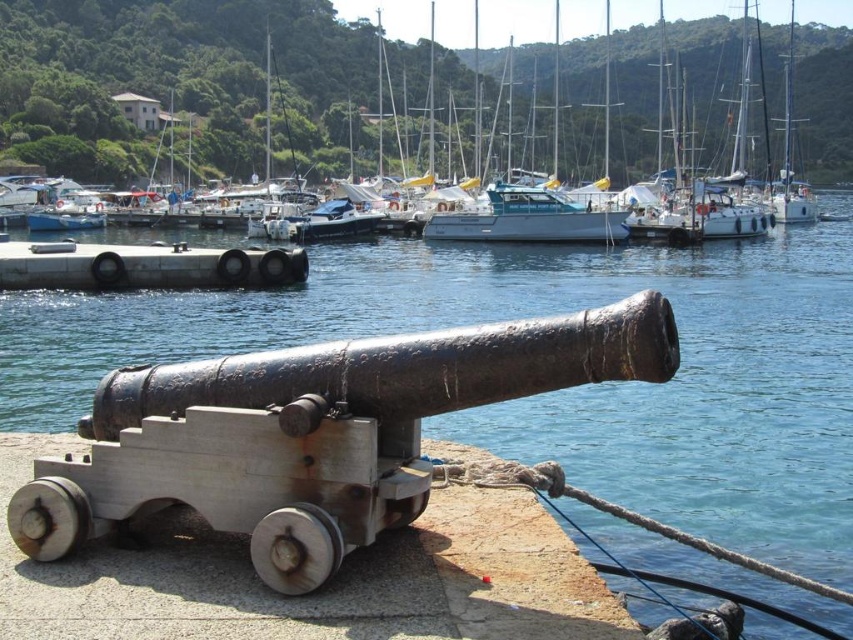
Question: Which object is farther from the camera taking this photo?

Choices:
 (A) rusty metal cannon at center
 (B) gray concrete dock at center
 (C) white plastic boat at upper center

Answer: (C)

Question: Observing the image, what is the correct spatial positioning of white plastic boat at upper center in reference to gray concrete dock at center?

Choices:
 (A) right
 (B) left

Answer: (A)

Question: Among these points, which one is farthest from the camera?

Choices:
 (A) (329, 86)
 (B) (399, 504)
 (C) (287, 278)

Answer: (A)

Question: Which is nearer to the gray concrete dock at center?

Choices:
 (A) rusty metal cannon at center
 (B) white plastic boat at upper center

Answer: (A)

Question: Can you confirm if white plastic boat at upper center is thinner than gray concrete dock at center?

Choices:
 (A) no
 (B) yes

Answer: (A)

Question: Does white plastic boat at upper center appear under rusty metal cannon at center?

Choices:
 (A) no
 (B) yes

Answer: (A)